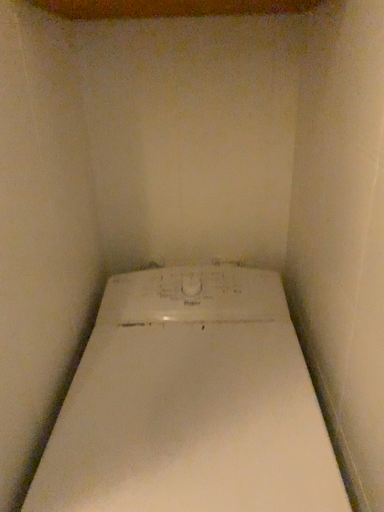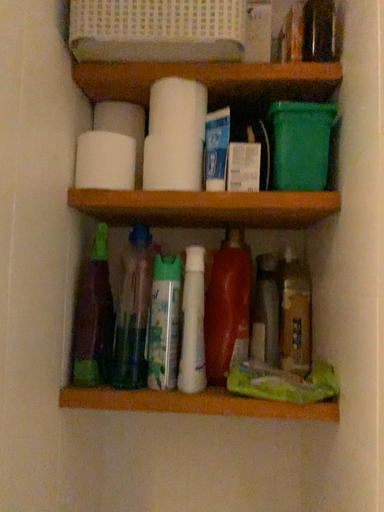
Question: How did the camera likely rotate when shooting the video?

Choices:
 (A) rotated downward
 (B) rotated upward

Answer: (B)